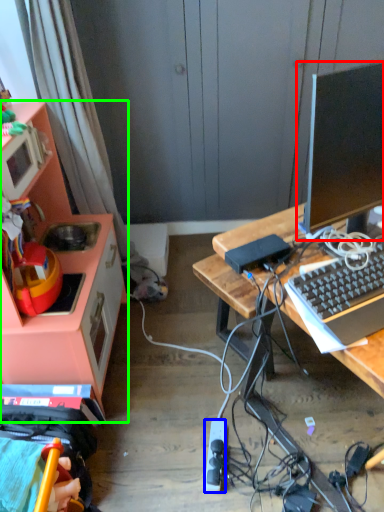
Question: Which is nearer to the television (highlighted by a red box)? power outlet (highlighted by a blue box) or cabinetry (highlighted by a green box).

Choices:
 (A) power outlet
 (B) cabinetry

Answer: (B)